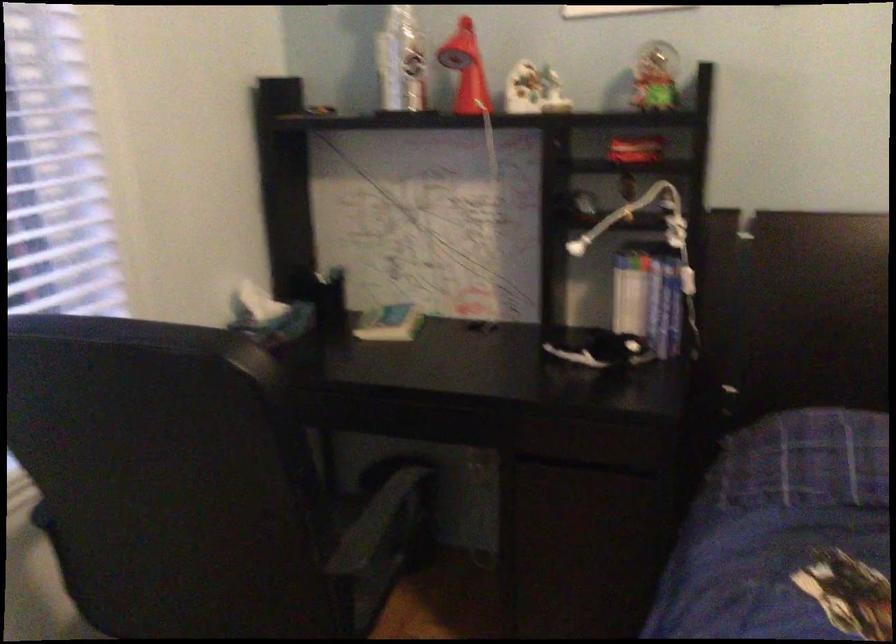
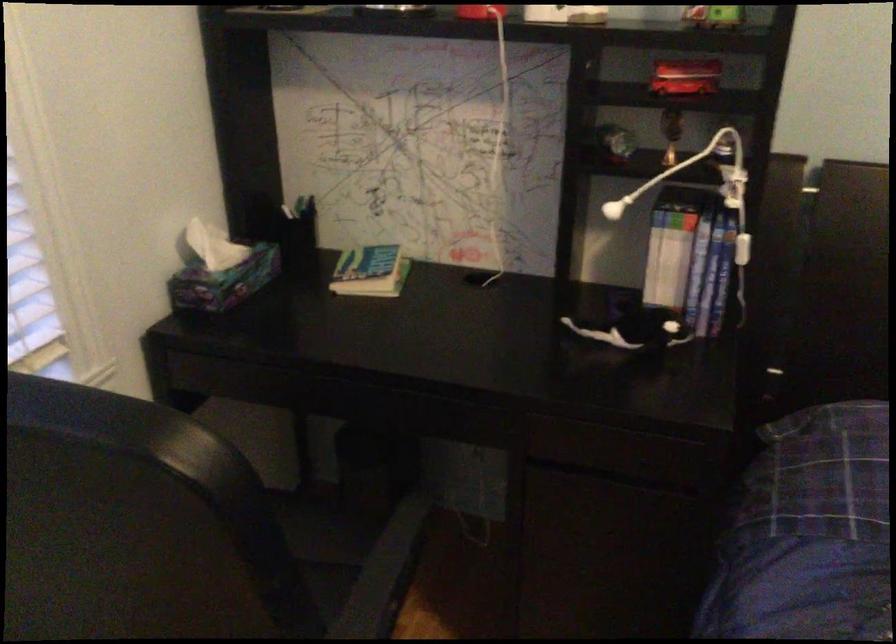
In the second image, find the point that corresponds to point 667,316 in the first image.

(707, 288)